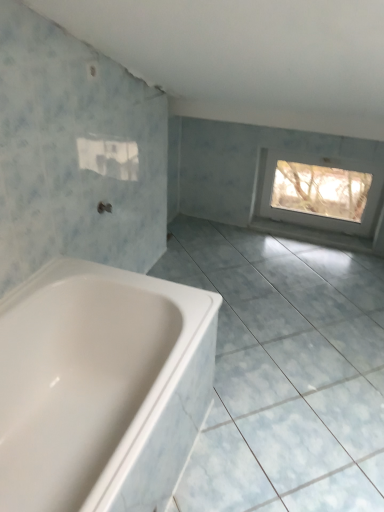
Question: Considering the relative sizes of matte silver tap at center and white glossy ceramic tile at lower left in the image provided, is matte silver tap at center bigger than white glossy ceramic tile at lower left?

Choices:
 (A) no
 (B) yes

Answer: (A)

Question: Can you confirm if matte silver tap at center is shorter than white glossy ceramic tile at lower left?

Choices:
 (A) yes
 (B) no

Answer: (B)

Question: From the image's perspective, is matte silver tap at center under white glossy ceramic tile at lower left?

Choices:
 (A) yes
 (B) no

Answer: (B)

Question: From a real-world perspective, is matte silver tap at center under white glossy ceramic tile at lower left?

Choices:
 (A) yes
 (B) no

Answer: (B)

Question: Is the depth of matte silver tap at center less than that of white glossy ceramic tile at lower left?

Choices:
 (A) yes
 (B) no

Answer: (B)

Question: Is transparent plastic window at upper right wider or thinner than matte silver tap at center?

Choices:
 (A) wide
 (B) thin

Answer: (B)

Question: From the image's perspective, relative to matte silver tap at center, is transparent plastic window at upper right above or below?

Choices:
 (A) below
 (B) above

Answer: (B)

Question: Relative to matte silver tap at center, is transparent plastic window at upper right in front or behind?

Choices:
 (A) front
 (B) behind

Answer: (B)

Question: Is transparent plastic window at upper right taller or shorter than matte silver tap at center?

Choices:
 (A) short
 (B) tall

Answer: (B)

Question: Is point (105, 209) positioned closer to the camera than point (329, 170)?

Choices:
 (A) farther
 (B) closer

Answer: (B)

Question: In the image, is matte silver tap at center positioned in front of or behind transparent plastic window at upper right?

Choices:
 (A) behind
 (B) front

Answer: (B)

Question: In the image, is matte silver tap at center on the left side or the right side of transparent plastic window at upper right?

Choices:
 (A) right
 (B) left

Answer: (B)

Question: From the image's perspective, is matte silver tap at center located above or below transparent plastic window at upper right?

Choices:
 (A) below
 (B) above

Answer: (A)

Question: Looking at their shapes, would you say white glossy ceramic tile at lower left is wider or thinner than white glossy bathtub at lower left?

Choices:
 (A) thin
 (B) wide

Answer: (B)

Question: From the image's perspective, is white glossy ceramic tile at lower left above or below white glossy bathtub at lower left?

Choices:
 (A) below
 (B) above

Answer: (B)